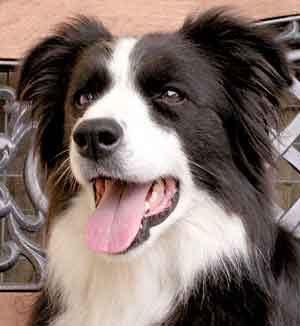
Where is `iron`? iron is located at coordinates (10, 236).